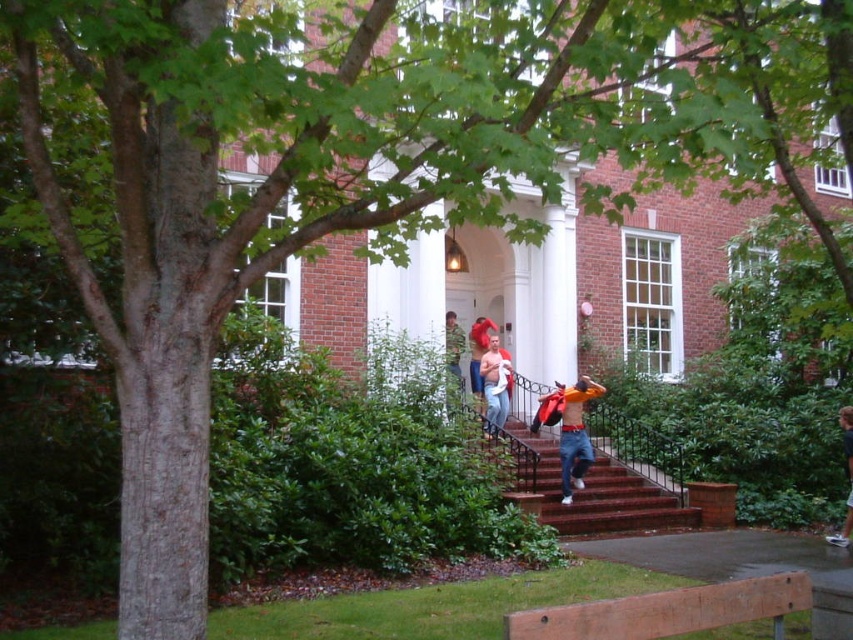
Between light blue jeans at center and light brown leather jacket at lower right, which one appears on the left side from the viewer's perspective?

light blue jeans at center

What do you see at coordinates (495, 385) in the screenshot? I see `light blue jeans at center` at bounding box center [495, 385].

You are a GUI agent. You are given a task and a screenshot of the screen. Output one action in this format:
    pyautogui.click(x=<x>, y=<y>)
    Task: Click on the light blue jeans at center
    The image size is (853, 640).
    Given the screenshot: What is the action you would take?
    pyautogui.click(x=495, y=385)

Is matte orange shirt at center behind camouflage jacket at center?

Yes, matte orange shirt at center is further from the viewer.

Between matte orange shirt at center and camouflage jacket at center, which one appears on the right side from the viewer's perspective?

From the viewer's perspective, matte orange shirt at center appears more on the right side.

Is point (474, 330) more distant than point (450, 349)?

Yes, it is.

Where is `matte orange shirt at center`? This screenshot has height=640, width=853. matte orange shirt at center is located at coordinates (479, 352).

Can you confirm if light blue jeans at center is taller than camouflage jacket at center?

Yes, light blue jeans at center is taller than camouflage jacket at center.

Find the location of a particular element. This screenshot has width=853, height=640. light blue jeans at center is located at coordinates (495, 385).